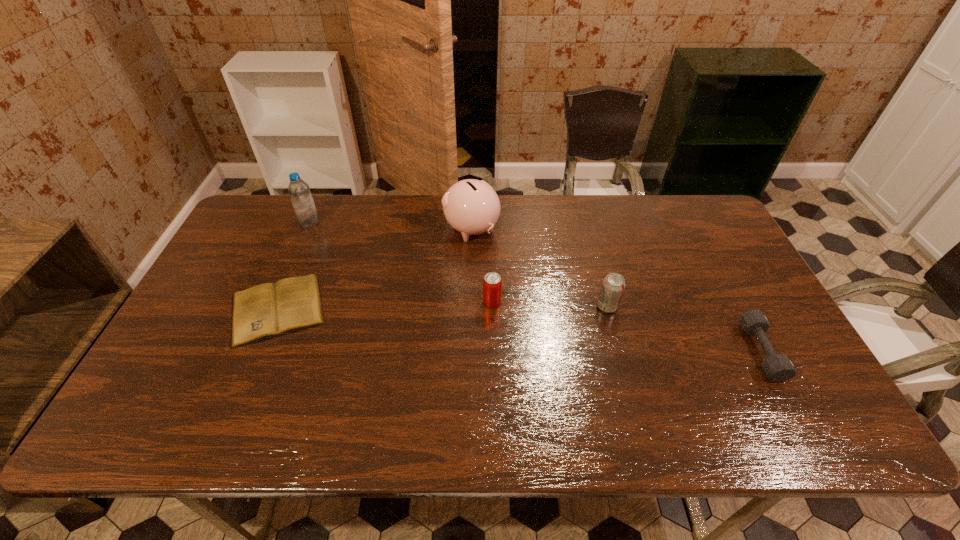
I want to click on vacant region located on the front of the can, so click(x=492, y=341).

You are a GUI agent. You are given a task and a screenshot of the screen. Output one action in this format:
    pyautogui.click(x=<x>, y=<y>)
    Task: Click on the vacant point located on the left of the rightmost object
    The width and height of the screenshot is (960, 540).
    Given the screenshot: What is the action you would take?
    pyautogui.click(x=666, y=351)

Find the location of a particular element. This screenshot has height=540, width=960. vacant space located 0.160m on the front of the book is located at coordinates (237, 407).

Find the location of `water bottle at the far edge`. water bottle at the far edge is located at coordinates (299, 191).

The width and height of the screenshot is (960, 540). In order to click on piggy bank that is positioned at the far edge in this screenshot , I will do `click(472, 207)`.

Identify the location of object that is at the left edge. (267, 310).

Locate an element on the screen. This screenshot has width=960, height=540. object located at the right edge is located at coordinates (778, 367).

Image resolution: width=960 pixels, height=540 pixels. Identify the location of free space at the far edge. (546, 197).

Locate an element on the screen. This screenshot has height=540, width=960. free space at the near edge of the desktop is located at coordinates 622,415.

In the image, there is a desktop. Where is `vacant space at the left edge`? vacant space at the left edge is located at coordinates (183, 356).